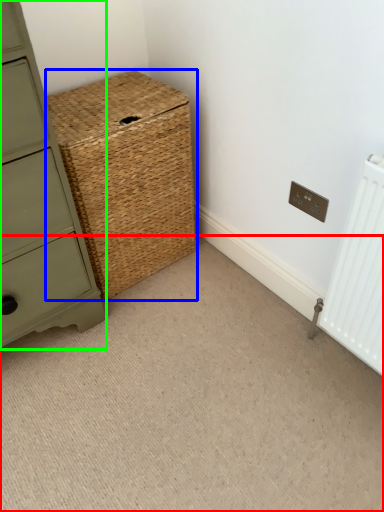
Question: Considering the real-world distances, which object is farthest from plain (highlighted by a red box)? basket (highlighted by a blue box) or chest of drawers (highlighted by a green box)?

Choices:
 (A) basket
 (B) chest of drawers

Answer: (A)